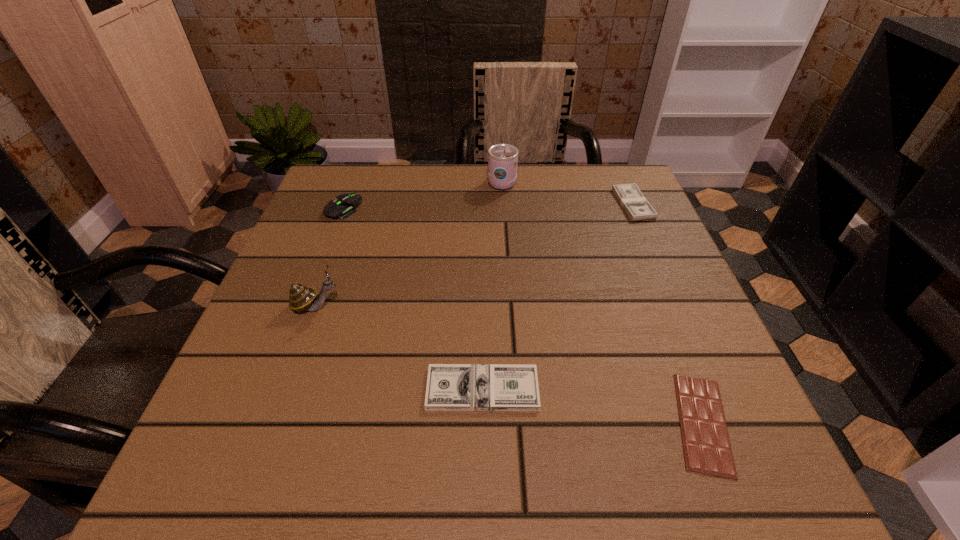
Find the location of a particular element. object that is the fourth closest to the second tallest object is located at coordinates (707, 449).

You are a GUI agent. You are given a task and a screenshot of the screen. Output one action in this format:
    pyautogui.click(x=<x>, y=<y>)
    Task: Click on the object that is the closest to the shortest object
    The height and width of the screenshot is (540, 960).
    Given the screenshot: What is the action you would take?
    pyautogui.click(x=452, y=387)

Image resolution: width=960 pixels, height=540 pixels. In order to click on free space that satisfies the following two spatial constraints: 1. on the face of the chocolate bar; 2. on the right side of the third nearest object in this screenshot , I will do `click(275, 423)`.

Identify the location of vacant space that satisfies the following two spatial constraints: 1. on the front side of the third tallest object; 2. on the left side of the second shortest object. 274,389.